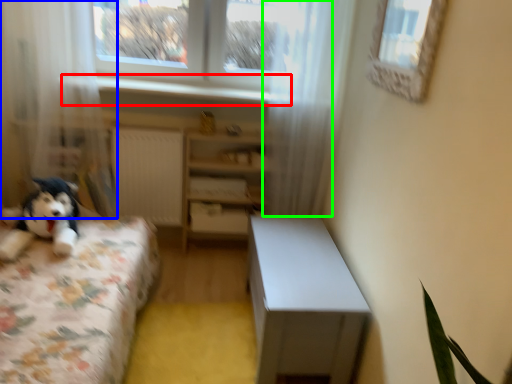
Question: Estimate the real-world distances between objects in this image. Which object is farther from window sill (highlighted by a red box), curtain (highlighted by a blue box) or curtain (highlighted by a green box)?

Choices:
 (A) curtain
 (B) curtain

Answer: (B)